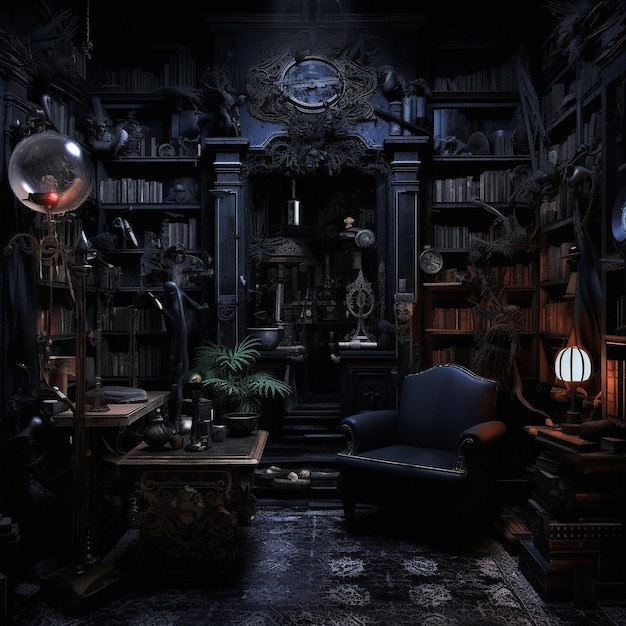
Where is `bookshelf`? This screenshot has width=626, height=626. bookshelf is located at coordinates (145, 197), (481, 193).